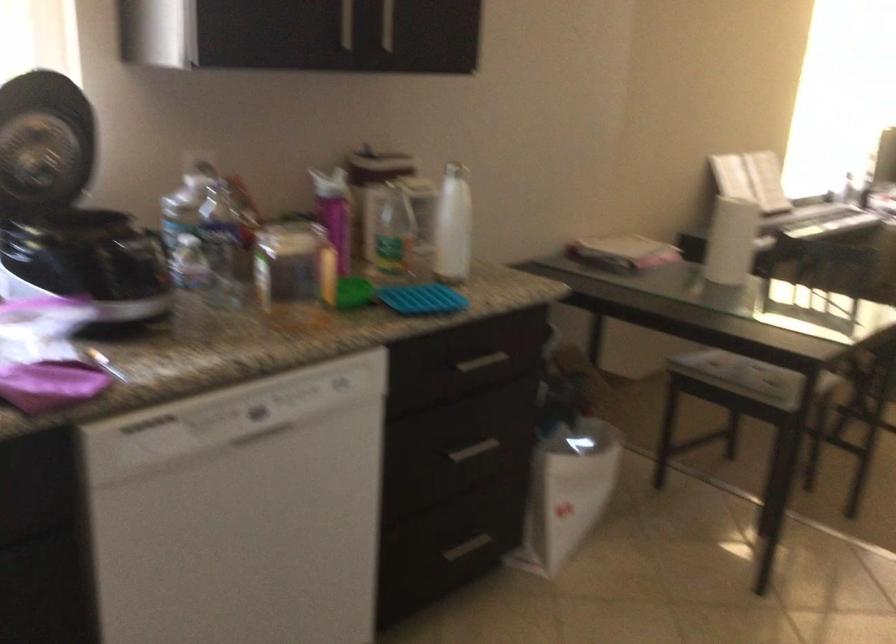
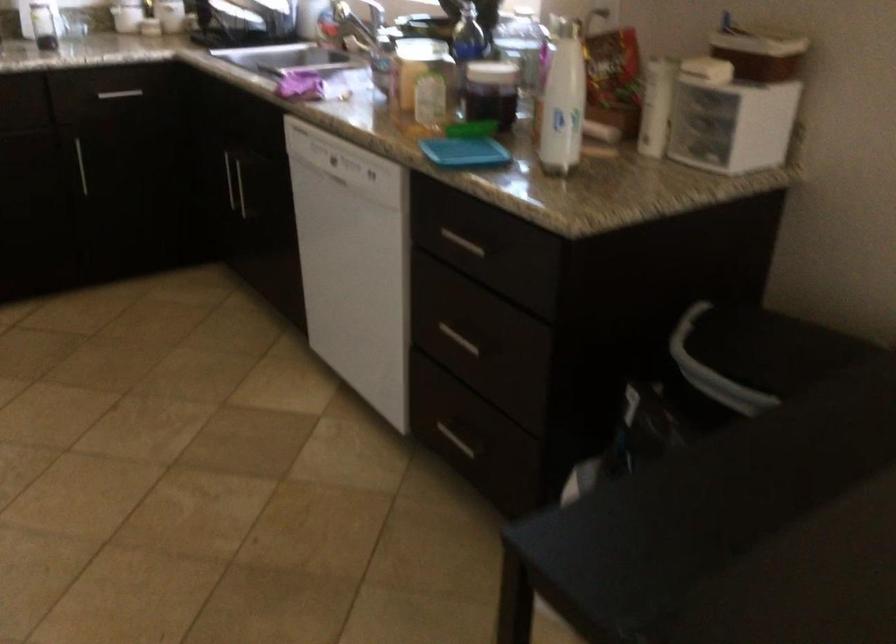
In the second image, find the point that corresponds to point (428, 524) in the first image.

(455, 440)